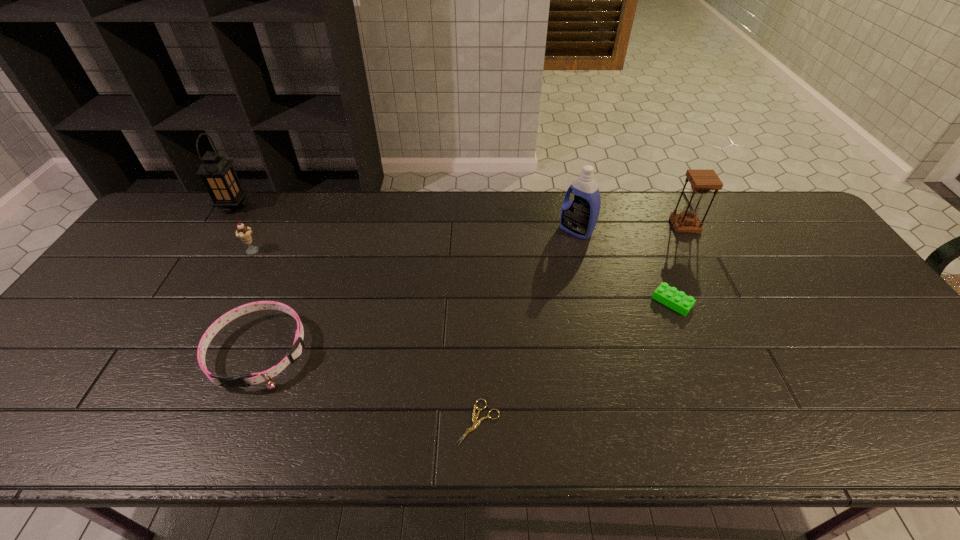
This screenshot has height=540, width=960. What are the coordinates of `shears` in the screenshot? It's located at [476, 422].

This screenshot has height=540, width=960. In order to click on the shortest object in this screenshot , I will do `click(476, 422)`.

Where is `vacant area located 0.240m on the right of the farthest object`? vacant area located 0.240m on the right of the farthest object is located at coordinates (319, 206).

Locate an element on the screen. This screenshot has height=540, width=960. vacant space situated 0.260m on the right of the detergent is located at coordinates (675, 230).

The height and width of the screenshot is (540, 960). What are the coordinates of `vacant area located 0.180m on the right of the hourglass` in the screenshot? It's located at (754, 226).

Where is `vacant space positioned on the left of the fourth farthest object`? This screenshot has width=960, height=540. vacant space positioned on the left of the fourth farthest object is located at coordinates pos(155,251).

You are a GUI agent. You are given a task and a screenshot of the screen. Output one action in this format:
    pyautogui.click(x=<x>, y=<y>)
    Task: Click on the free location located 0.050m with the buckle on the dog collar
    
    Given the screenshot: What is the action you would take?
    pyautogui.click(x=233, y=414)

Find the location of a particular element. This screenshot has width=960, height=540. vacant space located on the front of the sixth object from left to right is located at coordinates (724, 430).

At what (x,y) coordinates should I click in order to perform the action: click on blank space located on the back of the fourth object from right to left. Please return your answer as a coordinate pair (x, y). The height and width of the screenshot is (540, 960). Looking at the image, I should click on pyautogui.click(x=478, y=322).

This screenshot has width=960, height=540. In order to click on lantern that is positioned at the far edge in this screenshot , I will do pos(218,175).